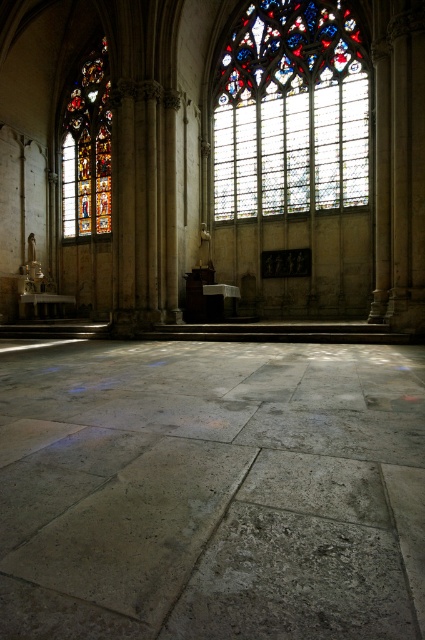
Question: Which of the following is the farthest from the observer?

Choices:
 (A) (96, 198)
 (B) (320, 113)

Answer: (A)

Question: Does stained glass window at center come behind stained glass window at left?

Choices:
 (A) no
 (B) yes

Answer: (A)

Question: Does stained glass window at center have a larger size compared to stained glass window at left?

Choices:
 (A) yes
 (B) no

Answer: (A)

Question: Which of the following is the farthest from the observer?

Choices:
 (A) (x=90, y=170)
 (B) (x=300, y=19)

Answer: (A)

Question: From the image, what is the correct spatial relationship of stained glass window at center in relation to stained glass window at left?

Choices:
 (A) left
 (B) right

Answer: (B)